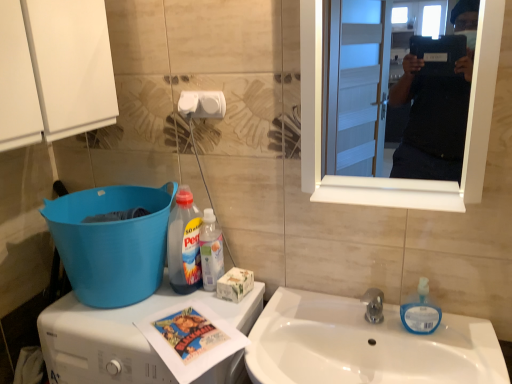
Locate an element on the screen. The width and height of the screenshot is (512, 384). vacant area that is in front of white cardboard box at lower center is located at coordinates (223, 321).